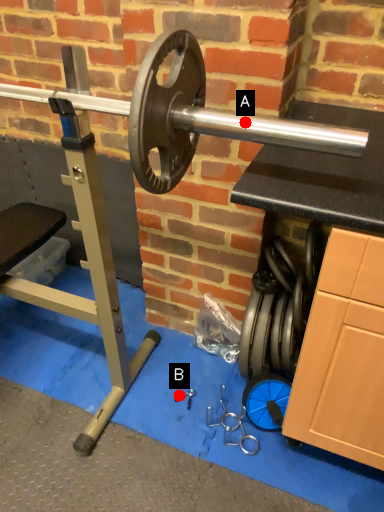
Question: Two points are circled on the image, labeled by A and B beside each circle. Which of the following is the closest to the observer?

Choices:
 (A) A is closer
 (B) B is closer

Answer: (A)